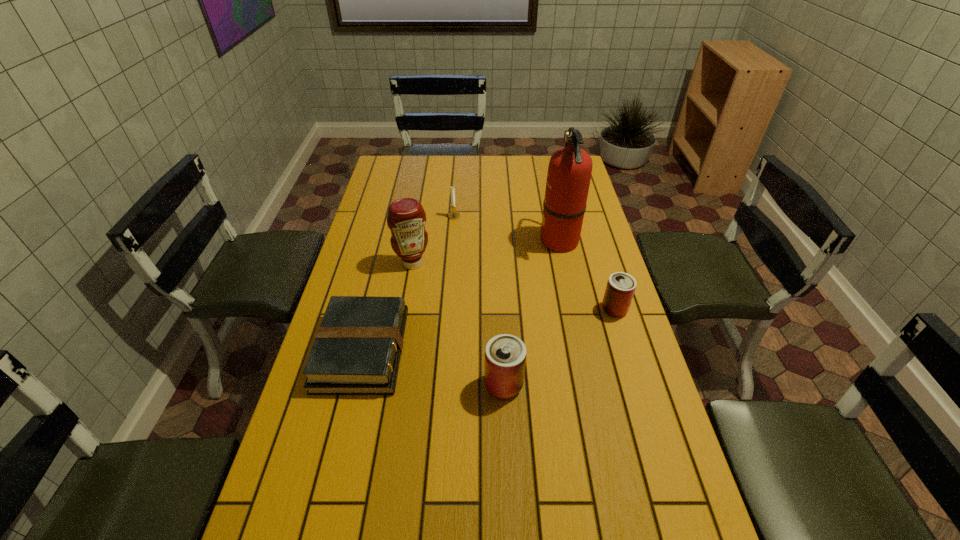
Given the evenly spaced cans in the image, where should an extra can be added on the left to preserve the spacing? Please point to a vacant space. Please provide its 2D coordinates. Your answer should be formatted as a tuple, i.e. [(x, y)], where the tuple contains the x and y coordinates of a point satisfying the conditions above.

[(348, 492)]